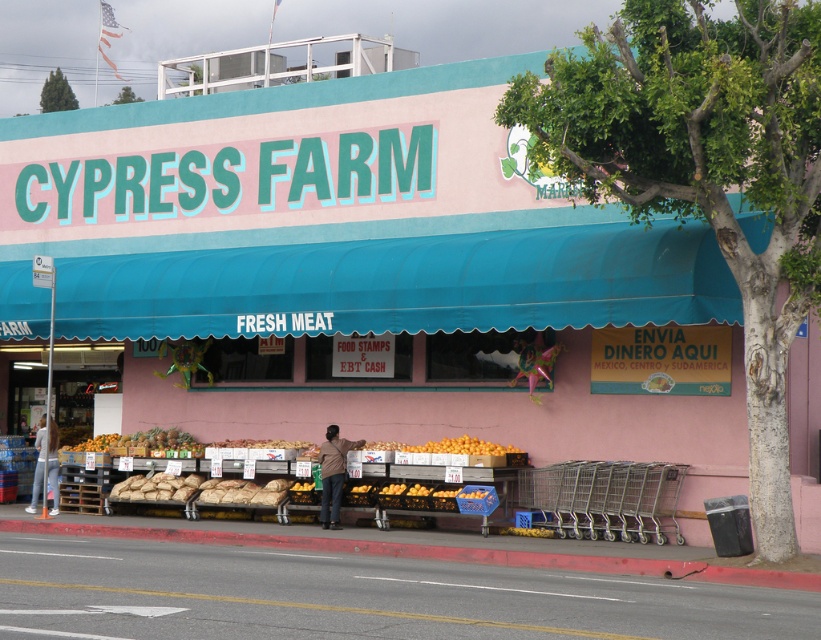
Does point (134, 435) lie behind point (480, 449)?

Yes, point (134, 435) is behind point (480, 449).

Between point (193, 448) and point (438, 444), which one is positioned behind?

Point (193, 448)

Is point (152, 444) positioned before point (411, 451)?

No, (152, 444) is further to viewer.

Find the location of a particular element. The image size is (821, 640). shiny golden pineapple at center is located at coordinates (143, 444).

Who is positioned more to the right, orange matte fruit at center or orange matte at center?

orange matte fruit at center

Is point (640, 474) farther from viewer compared to point (445, 436)?

That is False.

Find the location of a particular element. orange matte fruit at center is located at coordinates (604, 499).

Is orange matte fruit at center thinner than shiny golden pineapple at center?

No.

Which is behind, point (645, 474) or point (131, 449)?

The point (131, 449) is more distant.

In order to click on orange matte fruit at center in this screenshot , I will do `click(604, 499)`.

Find the location of a particular element. The width and height of the screenshot is (821, 640). orange matte fruit at center is located at coordinates (604, 499).